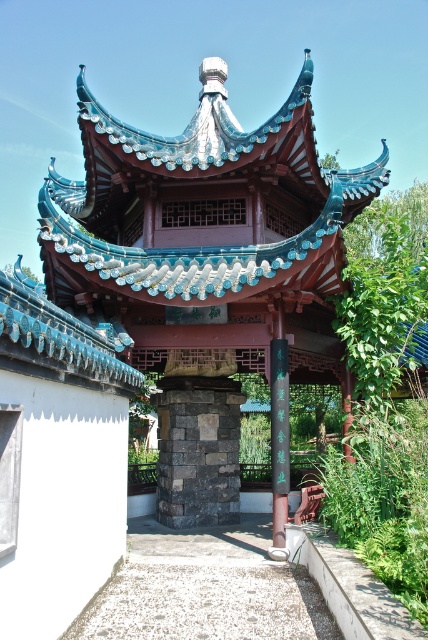
You are an architect designing a new traditional Chinese structure. You have two supports available, the dark gray stone pillar at center and the black polished wood pole at center. Which support should you choose if you need a larger one for structural stability?

The dark gray stone pillar at center is larger in size than the black polished wood pole at center, so you should choose the dark gray stone pillar at center for structural stability.

You are standing in front of the pavilion and want to touch both the dark gray stone pillar at center and the black polished wood pole at center. Which object should you reach for first to touch the one closer to you?

You should reach for the dark gray stone pillar at center first because it is closer to you than the black polished wood pole at center.

You are an architect examining the traditional Chinese structure. You notice the dark gray stone pillar at center and the black polished wood pole at center. Which object is positioned lower in the structure?

The dark gray stone pillar at center is positioned lower than the black polished wood pole at center.